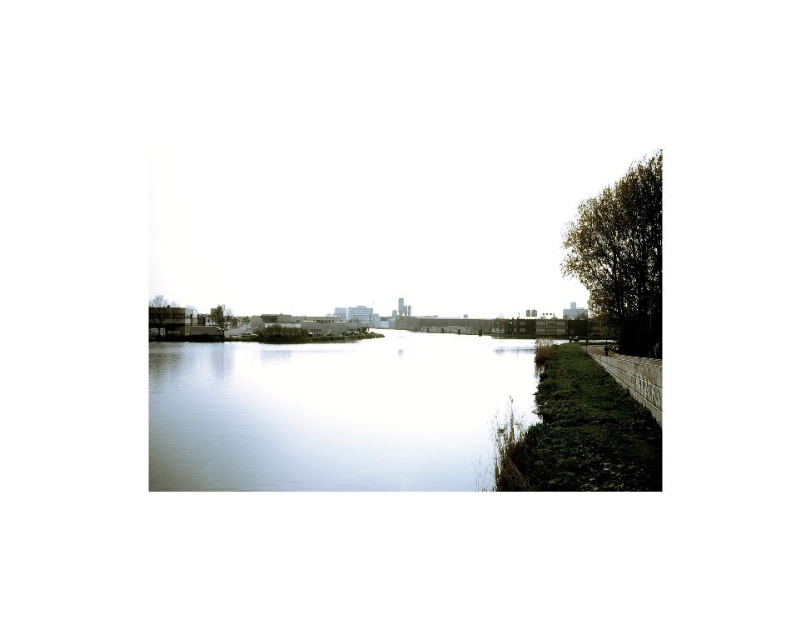
You are standing at the grassy embankment on the right side of the river and want to walk towards the point labeled point (518, 346) and point (618, 236). Which point will you reach first?

You will reach point (518, 346) first because it is closer to you than point (618, 236), which is further away.

You are a photographer planning to take a wide shot of the riverside scene. The smooth water at center and the green leafy tree at left are both in your frame. Based on their sizes in the image, which object would appear larger in the photo?

The smooth water at center appears larger in the photo because its width is greater than that of the green leafy tree at left.

You are standing at the center of the image and want to walk towards the green leafy tree at right. In which direction should you move?

You should move towards the right direction since the green leafy tree at right is located at the right side of the image.